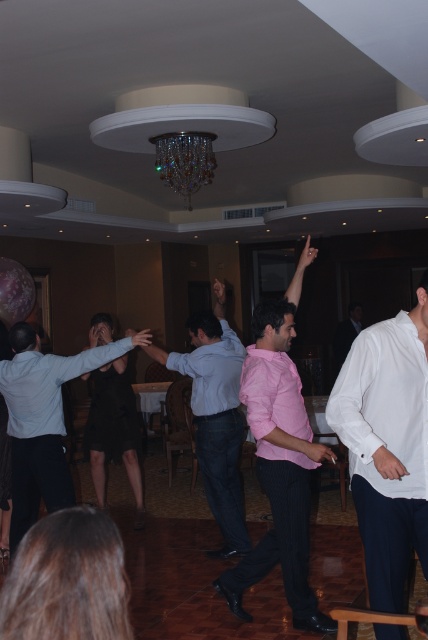
You are at a party and notice two shirts hanging on a coat rack. The white cotton shirt at right and the pink matte shirt at center. Which shirt is positioned higher on the coat rack?

The white cotton shirt at right is located above the pink matte shirt at center, so it is positioned higher on the coat rack.

You are at a party and see two shirts hanging on a coat rack. One is a white cotton shirt at right and the other is a matte white shirt at center. Which shirt is farther to the left?

The matte white shirt at center is farther to the left because the white cotton shirt at right is positioned on the right side of it.